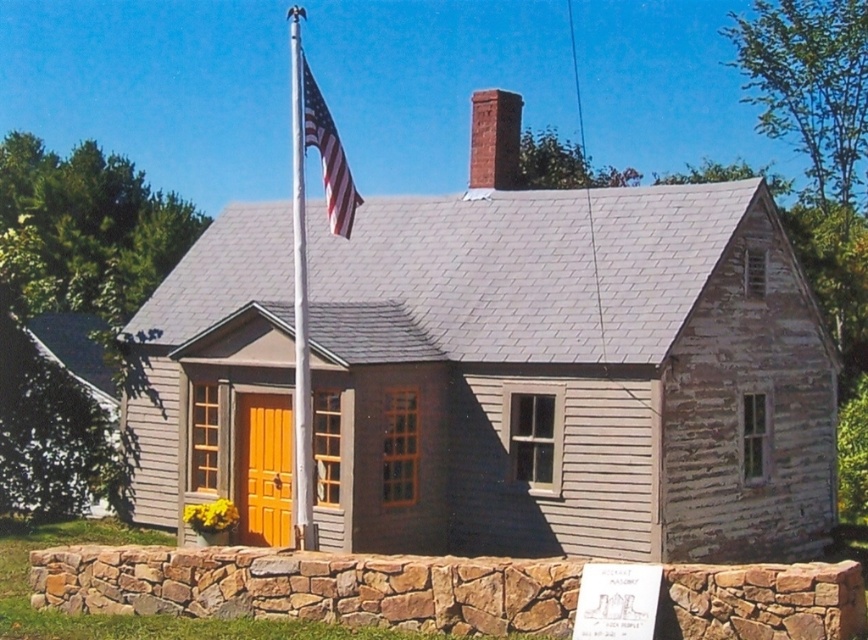
Question: Can you confirm if wooden door at center is positioned below red brick chimney at upper center?

Choices:
 (A) yes
 (B) no

Answer: (A)

Question: In this image, where is wooden door at center located relative to silver metallic flag pole at center?

Choices:
 (A) left
 (B) right

Answer: (B)

Question: In this image, where is wooden door at center located relative to silver metallic flag pole at center?

Choices:
 (A) below
 (B) above

Answer: (A)

Question: Which is nearer to the wooden door at center?

Choices:
 (A) silver metallic flag pole at center
 (B) american flag at center

Answer: (A)

Question: Which point is farther to the camera?

Choices:
 (A) (261, 504)
 (B) (474, 152)

Answer: (B)

Question: Which is farther from the american flag at center?

Choices:
 (A) silver metallic flag pole at center
 (B) wooden door at center

Answer: (B)